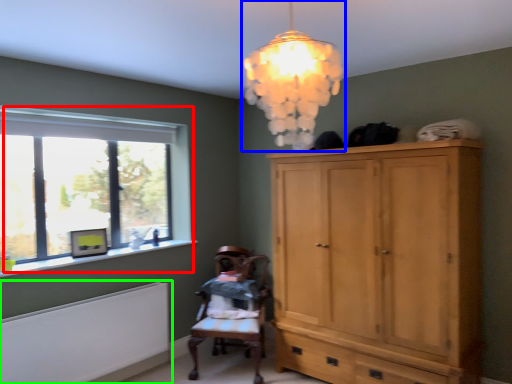
Question: Estimate the real-world distances between objects in this image. Which object is closer to window (highlighted by a red box), lamp (highlighted by a blue box) or radiator (highlighted by a green box)?

Choices:
 (A) lamp
 (B) radiator

Answer: (B)